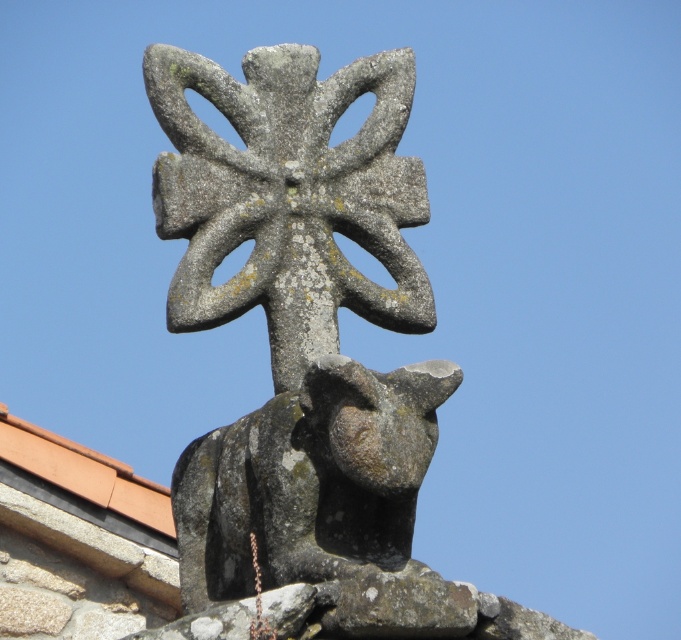
Question: Which object is closer to the camera taking this photo?

Choices:
 (A) terracotta tile roof at upper center
 (B) gray stone cross at center

Answer: (B)

Question: In this image, where is gray stone cross at center located relative to terracotta tile roof at upper center?

Choices:
 (A) left
 (B) right

Answer: (B)

Question: Which of the following is the farthest from the observer?

Choices:
 (A) (114, 477)
 (B) (259, 168)

Answer: (A)

Question: Is gray stone cross at center behind terracotta tile roof at upper center?

Choices:
 (A) yes
 (B) no

Answer: (B)

Question: Is gray stone cross at center thinner than terracotta tile roof at upper center?

Choices:
 (A) yes
 (B) no

Answer: (B)